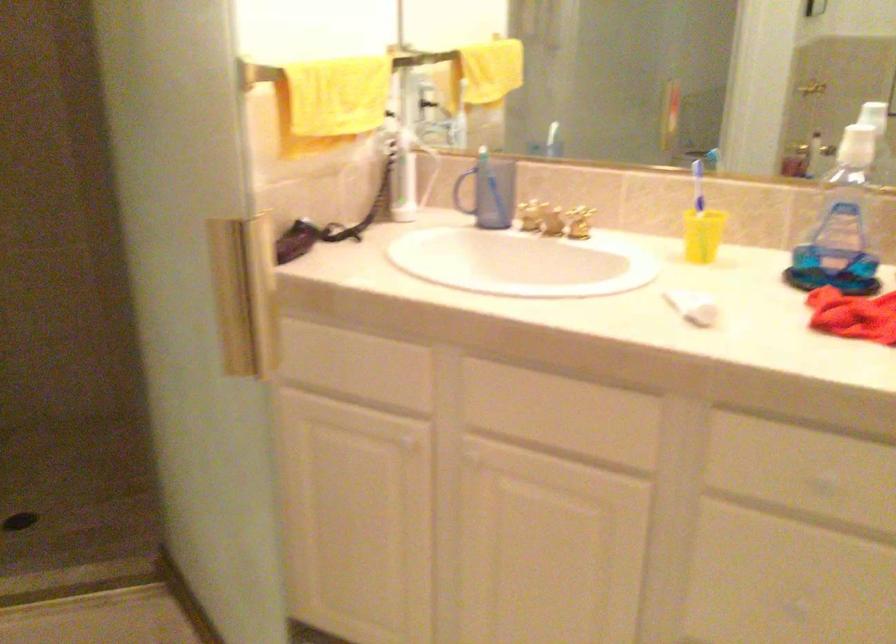
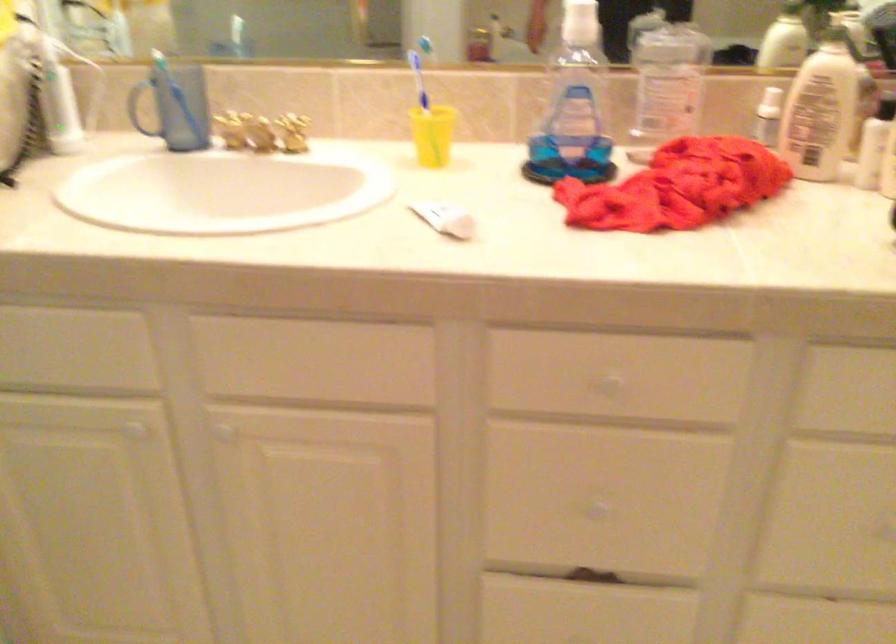
Where in the second image is the point corresponding to pixel 823 480 from the first image?

(609, 384)